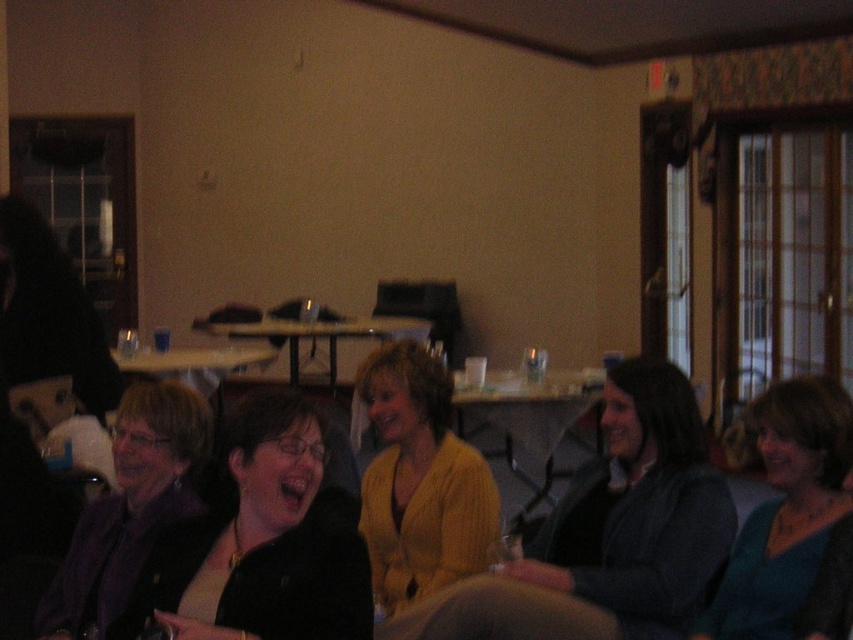
Question: Can you confirm if black matte glasses at center is positioned above white glossy table at center?

Choices:
 (A) yes
 (B) no

Answer: (B)

Question: Estimate the real-world distances between objects in this image. Which object is closer to the purple fabric jacket at lower left?

Choices:
 (A) teal matte sweater at center
 (B) white glossy table at center

Answer: (A)

Question: Is black matte glasses at center below white glossy table at center?

Choices:
 (A) yes
 (B) no

Answer: (A)

Question: Which object is positioned closest to the teal matte sweater at center?

Choices:
 (A) wooden table at center
 (B) yellow knitted sweater at center

Answer: (B)

Question: Can you confirm if yellow knitted sweater at center is positioned to the right of purple fabric jacket at lower left?

Choices:
 (A) yes
 (B) no

Answer: (A)

Question: Estimate the real-world distances between objects in this image. Which object is closer to the black matte glasses at center?

Choices:
 (A) wooden table at center
 (B) white glossy table at center

Answer: (A)